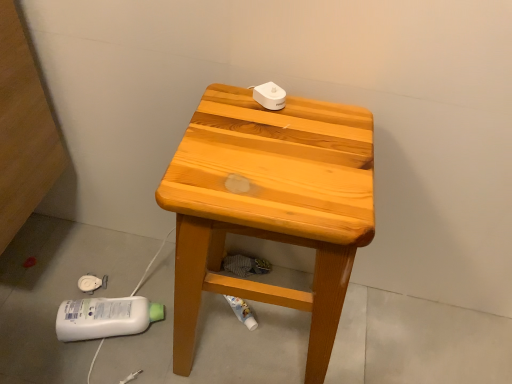
Find the location of a particular element. empty space that is to the right of light brown wooden stool at center is located at coordinates (378, 338).